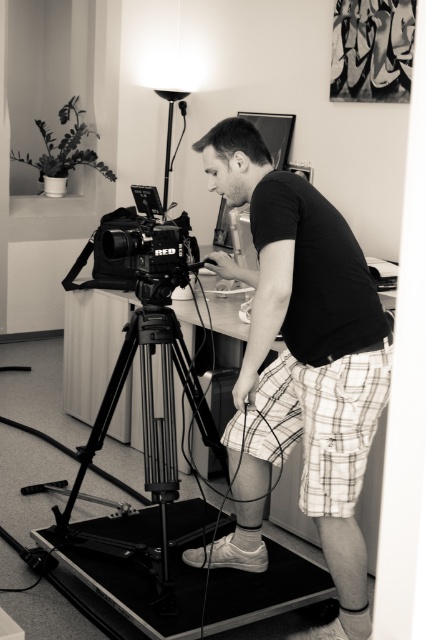
You are standing in the studio and want to reach the black metal tripod at center to adjust its height. Considering your height is 5 feet 8 inches, can you comfortably reach it without needing a stool?

The black metal tripod at center is 7.11 feet away from the viewer. Since the tripod is at center and the distance is measured from the viewer, the height of the tripod may not be directly related to the distance. Therefore, it is unclear if you can reach it comfortably without more information about its height.

Based on the scene description and the coordinates provided, what object is located at point (x=322, y=422)?

The point (x=322, y=422) corresponds to the white plaid shorts at center.